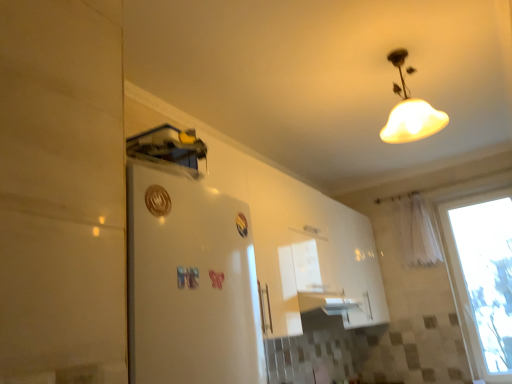
Question: Does white sheer curtain at right come behind transparent glass window at right?

Choices:
 (A) no
 (B) yes

Answer: (B)

Question: Is white sheer curtain at right facing away from transparent glass window at right?

Choices:
 (A) no
 (B) yes

Answer: (A)

Question: Would you say white sheer curtain at right is outside transparent glass window at right?

Choices:
 (A) yes
 (B) no

Answer: (A)

Question: Considering the relative sizes of white sheer curtain at right and transparent glass window at right in the image provided, is white sheer curtain at right bigger than transparent glass window at right?

Choices:
 (A) no
 (B) yes

Answer: (A)

Question: Is transparent glass window at right completely or partially inside white sheer curtain at right?

Choices:
 (A) no
 (B) yes

Answer: (A)

Question: Is white sheer curtain at right taller than transparent glass window at right?

Choices:
 (A) no
 (B) yes

Answer: (A)

Question: Is the position of transparent glass window at right more distant than that of white sheer curtain at right?

Choices:
 (A) yes
 (B) no

Answer: (B)

Question: Is the depth of transparent glass window at right less than that of white sheer curtain at right?

Choices:
 (A) no
 (B) yes

Answer: (B)

Question: Can you confirm if transparent glass window at right is smaller than white sheer curtain at right?

Choices:
 (A) no
 (B) yes

Answer: (A)

Question: Does transparent glass window at right contain white sheer curtain at right?

Choices:
 (A) yes
 (B) no

Answer: (B)

Question: Is transparent glass window at right bigger than white sheer curtain at right?

Choices:
 (A) no
 (B) yes

Answer: (B)

Question: Is transparent glass window at right taller than white sheer curtain at right?

Choices:
 (A) no
 (B) yes

Answer: (B)

Question: Can you confirm if white matte lampshade at upper center is positioned to the left of white sheer curtain at right?

Choices:
 (A) no
 (B) yes

Answer: (B)